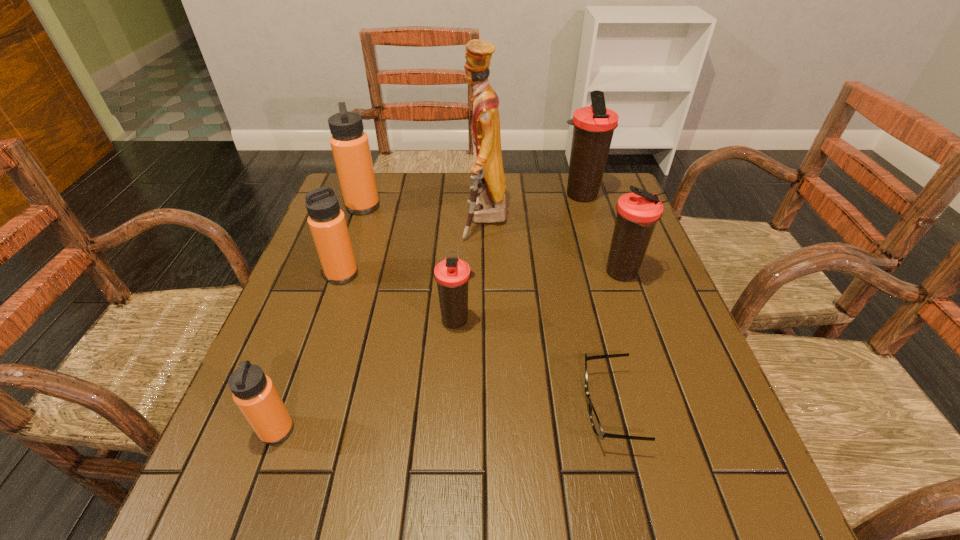
Where is `free region at the left edge of the desktop`? The image size is (960, 540). free region at the left edge of the desktop is located at coordinates (362, 260).

Image resolution: width=960 pixels, height=540 pixels. What are the coordinates of `free region at the right edge of the desktop` in the screenshot? It's located at (609, 277).

In the image, there is a desktop. At what (x,y) coordinates should I click in order to perform the action: click on vacant space at the far left corner. Please return your answer as a coordinate pair (x, y). The height and width of the screenshot is (540, 960). Looking at the image, I should click on (390, 176).

Identify the location of free space at the far right corner of the desktop. (602, 195).

Where is `vacant space in between the shortest object and the red nutcracker`? vacant space in between the shortest object and the red nutcracker is located at coordinates (547, 314).

Identify the location of free spot between the biggest orange thermos bottle and the smallest orange thermos bottle. The height and width of the screenshot is (540, 960). pos(320,318).

Find the location of a particular element. The height and width of the screenshot is (540, 960). empty location between the farthest brown thermos bottle and the second nearest brown thermos bottle is located at coordinates (601, 234).

Image resolution: width=960 pixels, height=540 pixels. In order to click on vacant point located between the second nearest orange thermos bottle and the red nutcracker in this screenshot , I will do `click(414, 247)`.

Identify the location of free space that is in between the biggest orange thermos bottle and the nearest brown thermos bottle. This screenshot has height=540, width=960. (410, 263).

Where is `vacant area that lies between the second nearest orange thermos bottle and the spectacles`? This screenshot has height=540, width=960. vacant area that lies between the second nearest orange thermos bottle and the spectacles is located at coordinates (475, 341).